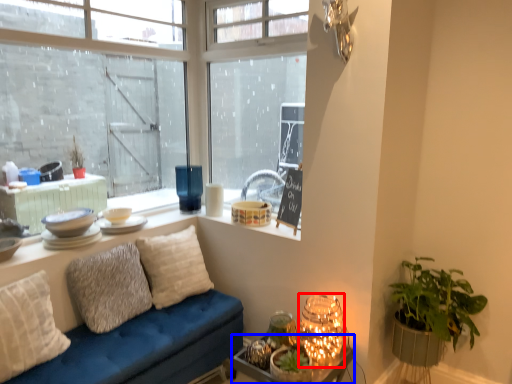
Question: Which point is closer to the camera, table (highlighted by a red box) or table (highlighted by a blue box)?

Choices:
 (A) table
 (B) table

Answer: (B)